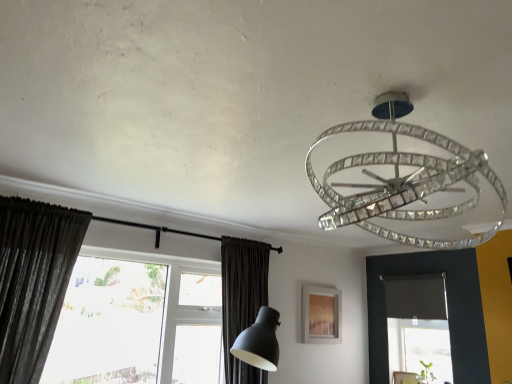
Question: Is clear crystal chandelier at upper center at the back of dark matte fabric curtain at lower center, arranged as the 1th curtain when viewed from the back?

Choices:
 (A) no
 (B) yes

Answer: (A)

Question: Does dark matte fabric curtain at lower center, which is counted as the second curtain, starting from the left, have a lesser width compared to clear crystal chandelier at upper center?

Choices:
 (A) no
 (B) yes

Answer: (B)

Question: Is dark matte fabric curtain at lower center, arranged as the 1th curtain when viewed from the back, bigger than clear crystal chandelier at upper center?

Choices:
 (A) no
 (B) yes

Answer: (B)

Question: Can you confirm if dark matte fabric curtain at lower center, arranged as the 1th curtain when viewed from the back, is positioned to the left of clear crystal chandelier at upper center?

Choices:
 (A) no
 (B) yes

Answer: (B)

Question: Does dark matte fabric curtain at lower center, which is counted as the second curtain, starting from the left, have a smaller size compared to clear crystal chandelier at upper center?

Choices:
 (A) yes
 (B) no

Answer: (B)

Question: Is dark matte fabric curtain at lower center, arranged as the second curtain when viewed from the front, far from clear crystal chandelier at upper center?

Choices:
 (A) no
 (B) yes

Answer: (B)

Question: Can you confirm if clear crystal chandelier at upper center is bigger than transparent glass window at lower left?

Choices:
 (A) yes
 (B) no

Answer: (B)

Question: Is clear crystal chandelier at upper center facing away from transparent glass window at lower left?

Choices:
 (A) no
 (B) yes

Answer: (A)

Question: Does clear crystal chandelier at upper center have a smaller size compared to transparent glass window at lower left?

Choices:
 (A) no
 (B) yes

Answer: (B)

Question: From the image's perspective, is clear crystal chandelier at upper center above transparent glass window at lower left?

Choices:
 (A) no
 (B) yes

Answer: (B)

Question: Considering the relative sizes of clear crystal chandelier at upper center and transparent glass window at lower left in the image provided, is clear crystal chandelier at upper center shorter than transparent glass window at lower left?

Choices:
 (A) yes
 (B) no

Answer: (A)

Question: Does clear crystal chandelier at upper center appear on the right side of transparent glass window at lower left?

Choices:
 (A) yes
 (B) no

Answer: (A)

Question: Is dark gray textured curtain at left, the 2th curtain from the back, to the right of transparent glass window at lower left from the viewer's perspective?

Choices:
 (A) yes
 (B) no

Answer: (B)